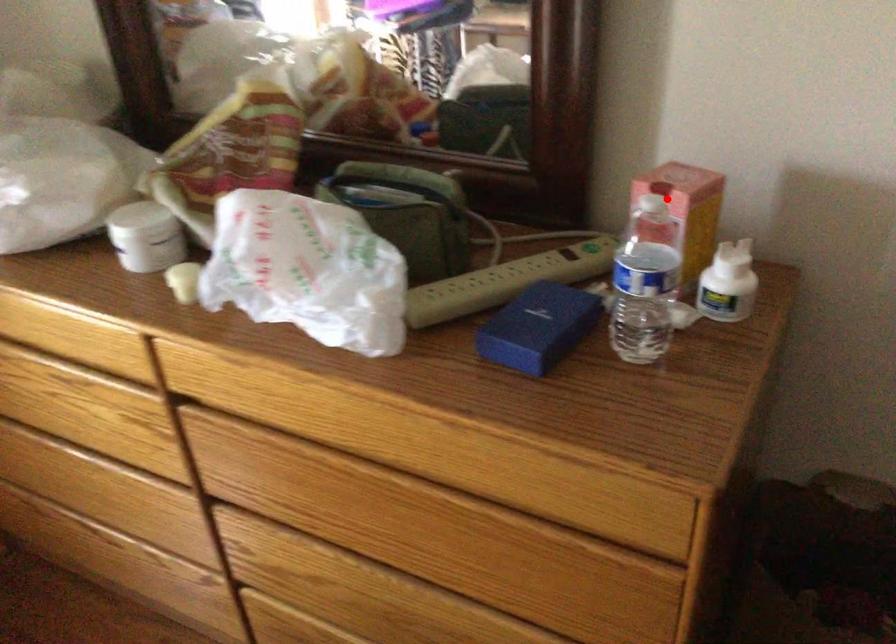
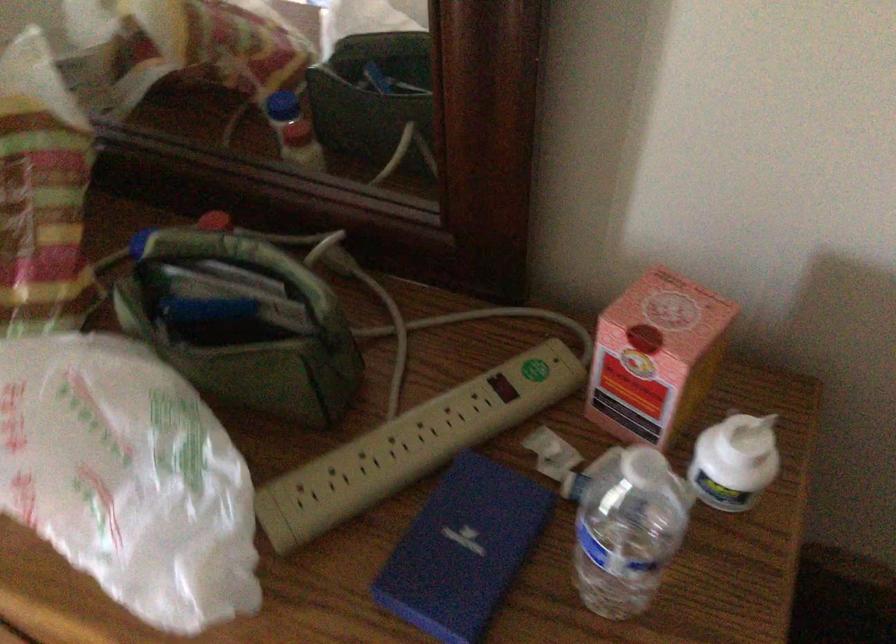
Question: I am providing you with two images of the same scene from different viewpoints. A red point is shown in image1. For the corresponding object point in image2, is it positioned nearer or farther from the camera?

Choices:
 (A) Nearer
 (B) Farther

Answer: (A)